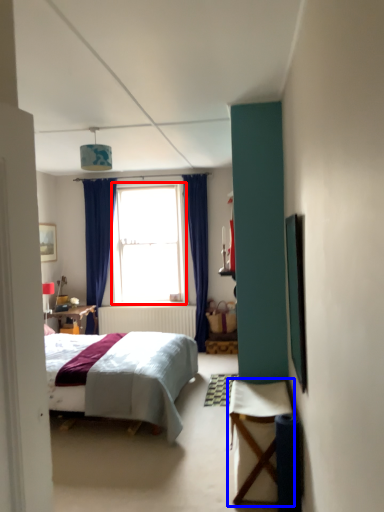
Question: Which point is closer to the camera, window (highlighted by a red box) or table (highlighted by a blue box)?

Choices:
 (A) window
 (B) table

Answer: (B)